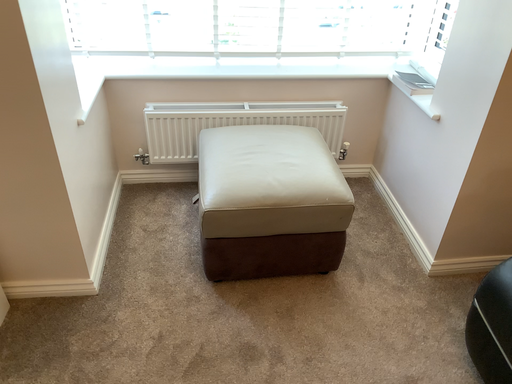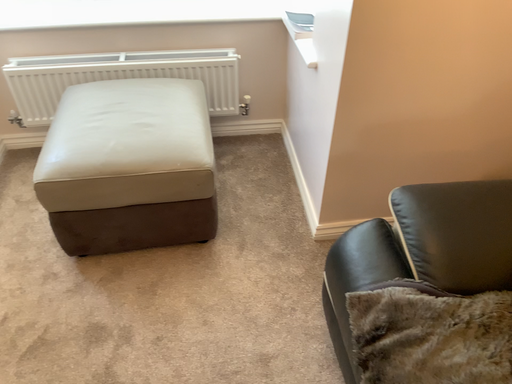
Question: How did the camera likely rotate when shooting the video?

Choices:
 (A) rotated upward
 (B) rotated downward

Answer: (B)